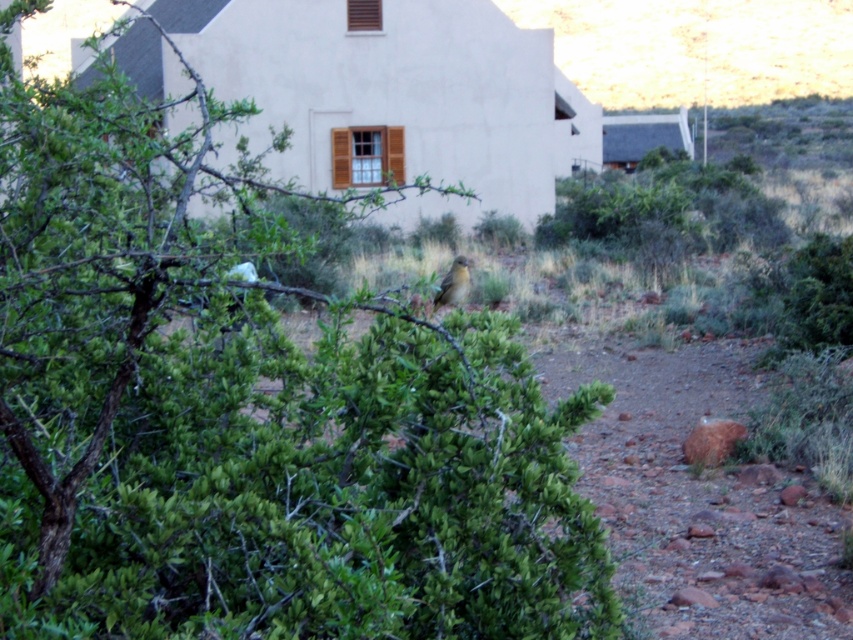
Can you confirm if green leafy bush at center is positioned below brown feathered bird at center?

Correct, green leafy bush at center is located below brown feathered bird at center.

Between green leafy bush at center and brown feathered bird at center, which one has less height?

Standing shorter between the two is brown feathered bird at center.

Does point (86, 150) lie behind point (450, 292)?

No, (86, 150) is closer to viewer.

This screenshot has height=640, width=853. What are the coordinates of `green leafy bush at center` in the screenshot? It's located at (252, 419).